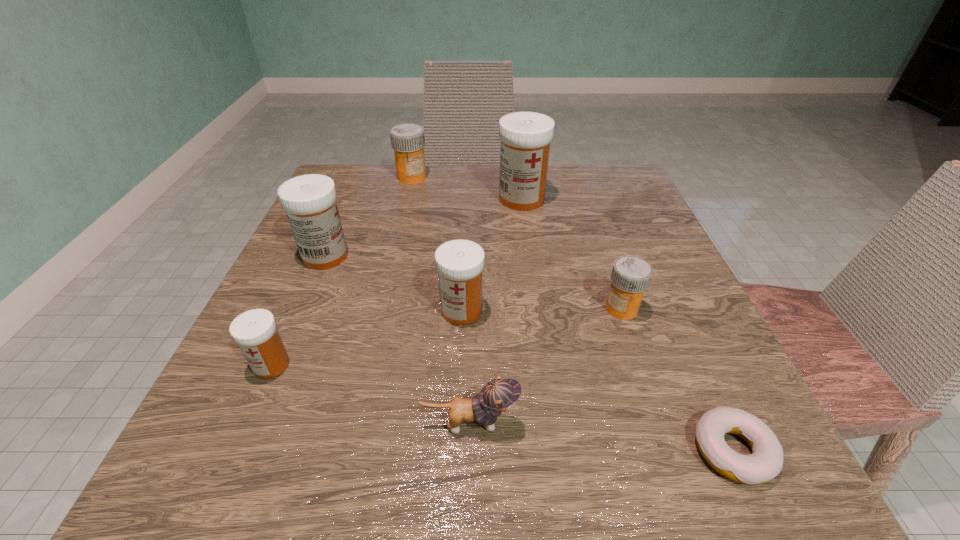
This screenshot has height=540, width=960. I want to click on free space between the nearest medicine and the second object from right to left, so click(446, 337).

At what (x,y) coordinates should I click in order to perform the action: click on free area in between the shortest object and the kitten. Please return your answer as a coordinate pair (x, y). This screenshot has width=960, height=540. Looking at the image, I should click on (601, 437).

What are the coordinates of `free point between the doughnut and the kitten` in the screenshot? It's located at (601, 437).

The image size is (960, 540). Find the location of `unoccupied position between the shortest object and the third smallest white medicine`. unoccupied position between the shortest object and the third smallest white medicine is located at coordinates point(529,353).

This screenshot has height=540, width=960. What are the coordinates of `object that is the fourth closest one to the fifth shortest medicine` in the screenshot? It's located at (525, 136).

At what (x,y) coordinates should I click in order to perform the action: click on the fifth closest object relative to the kitten. Please return your answer as a coordinate pair (x, y). The height and width of the screenshot is (540, 960). Looking at the image, I should click on (309, 200).

You are a GUI agent. You are given a task and a screenshot of the screen. Output one action in this format:
    pyautogui.click(x=<x>, y=<y>)
    Task: Click on the medicine that stands as the closest to the second medicine from right to left
    
    Given the screenshot: What is the action you would take?
    pyautogui.click(x=408, y=140)

What are the coordinates of `medicine that stands as the second closest to the left orange medicine` in the screenshot? It's located at (309, 200).

Find the location of `the fourth closest white medicine relative to the nearer orange medicine`. the fourth closest white medicine relative to the nearer orange medicine is located at coordinates (255, 331).

Where is `the second closest white medicine to the smallest white medicine`? the second closest white medicine to the smallest white medicine is located at coordinates (459, 263).